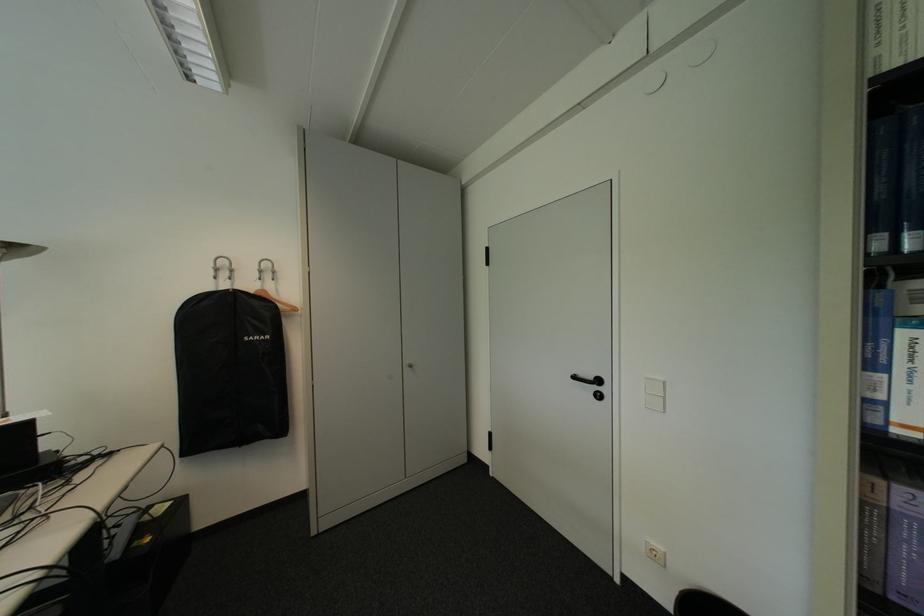
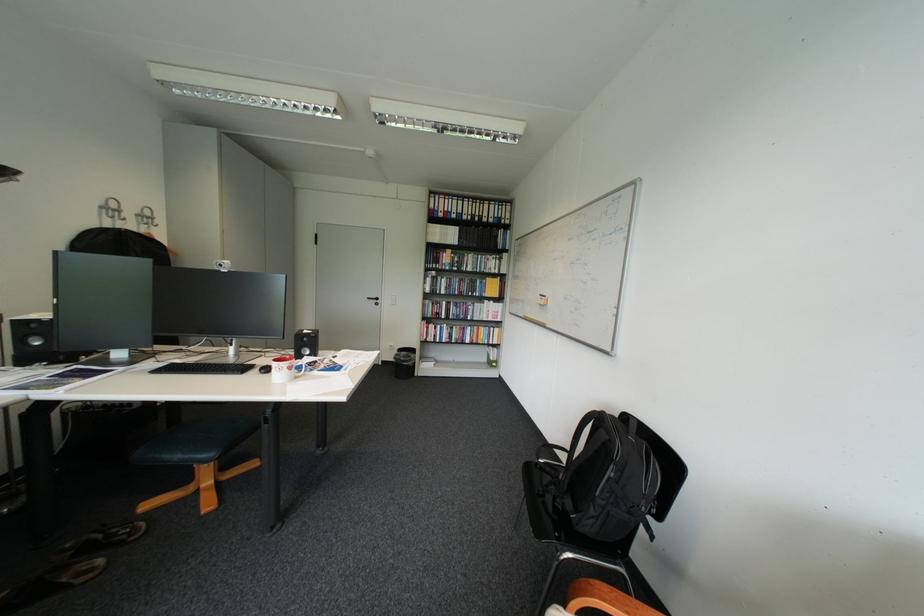
Where in the second image is the point corresponding to pixel 637 578 from the first image?

(395, 362)